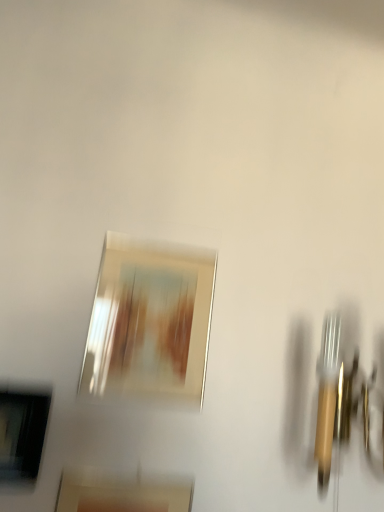
Question: From the image's perspective, is matte black picture frame at lower left, marked as the second picture frame in a top-to-bottom arrangement, positioned above or below matte gold picture frame at center, positioned as the 1th picture frame in bottom-to-top order?

Choices:
 (A) below
 (B) above

Answer: (B)

Question: Is matte black picture frame at lower left, the 2th picture frame positioned from the bottom, bigger or smaller than matte gold picture frame at center, which is counted as the 3th picture frame, starting from the top?

Choices:
 (A) big
 (B) small

Answer: (B)

Question: Which object is positioned closest to the metallic silver picture frame at center, which is counted as the 3th picture frame, starting from the bottom?

Choices:
 (A) matte gold picture frame at center, positioned as the 1th picture frame in bottom-to-top order
 (B) matte black picture frame at lower left, marked as the second picture frame in a top-to-bottom arrangement

Answer: (B)

Question: Which object is the farthest from the matte black picture frame at lower left, marked as the second picture frame in a top-to-bottom arrangement?

Choices:
 (A) metallic silver picture frame at center, the 1th picture frame in the top-to-bottom sequence
 (B) matte gold picture frame at center, positioned as the 1th picture frame in bottom-to-top order

Answer: (A)